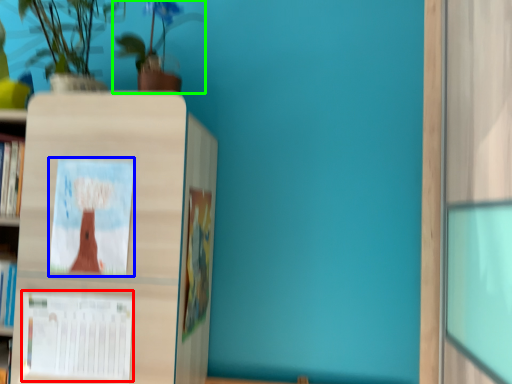
Question: Estimate the real-world distances between objects in this image. Which object is closer to book cover (highlighted by a red box), book cover (highlighted by a blue box) or houseplant (highlighted by a green box)?

Choices:
 (A) book cover
 (B) houseplant

Answer: (A)